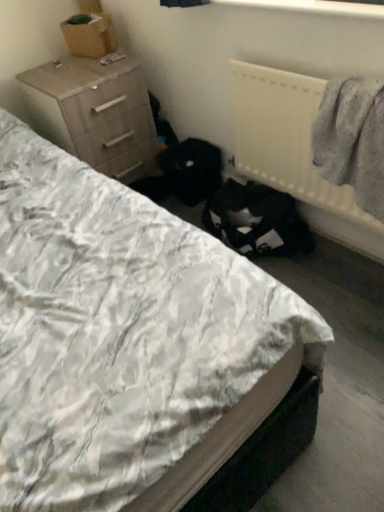
Question: From a real-world perspective, relative to white plastic radiator at upper right, is light brown wood chest of drawers at upper left vertically above or below?

Choices:
 (A) below
 (B) above

Answer: (A)

Question: In terms of width, does light brown wood chest of drawers at upper left look wider or thinner when compared to white plastic radiator at upper right?

Choices:
 (A) thin
 (B) wide

Answer: (B)

Question: Estimate the real-world distances between objects in this image. Which object is farther from the gray woolen sweater at right?

Choices:
 (A) light brown wood chest of drawers at upper left
 (B) white plastic radiator at upper right
 (C) white quilted bed at center

Answer: (A)

Question: Considering the real-world distances, which object is farthest from the white plastic radiator at upper right?

Choices:
 (A) white quilted bed at center
 (B) light brown wood chest of drawers at upper left
 (C) gray woolen sweater at right

Answer: (A)